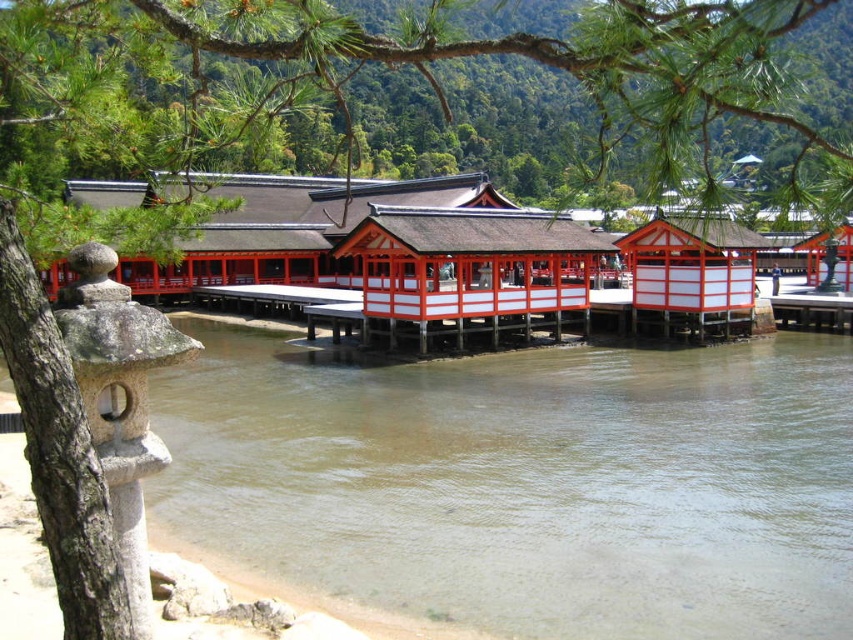
In the scene shown: You are standing at the center of the Itsukushima Shrine and want to take a photo of the iconic floating torii gate. To ensure the clear water at river left is visible in the background, where should you position yourself relative to the point marked at coordinates (529, 483)?

You should position yourself to the right of the point marked at coordinates (529, 483) to ensure the clear water at river left is visible in the background, as that point corresponds to the clear water at river left.